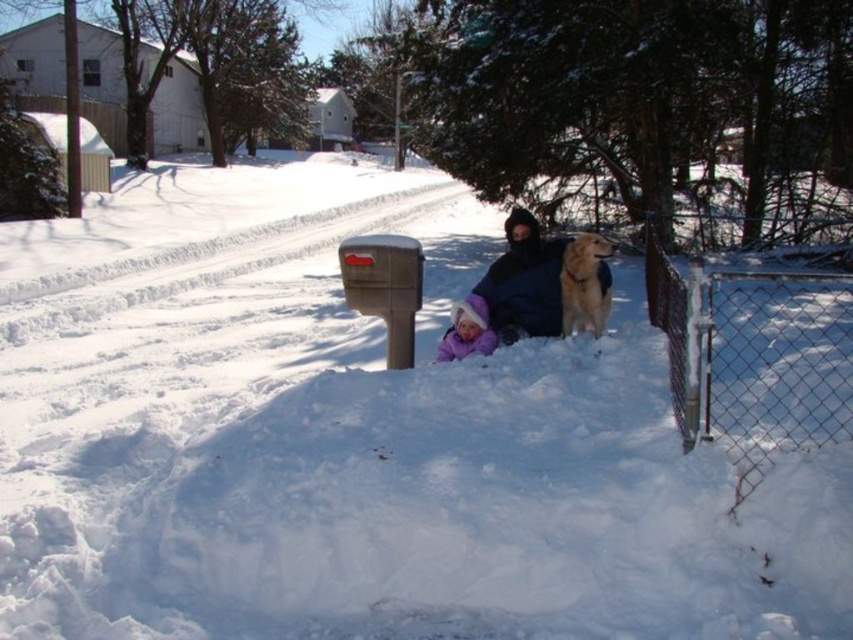
Question: Can you confirm if dark blue jacket at center is thinner than golden fur dog at center?

Choices:
 (A) no
 (B) yes

Answer: (A)

Question: Is gray plastic mailbox at center positioned behind golden fur dog at center?

Choices:
 (A) yes
 (B) no

Answer: (B)

Question: Which of the following is the farthest from the observer?

Choices:
 (A) (474, 301)
 (B) (392, 280)
 (C) (578, 296)

Answer: (A)

Question: Is chain-link fence at lower right thinner than golden fur dog at center?

Choices:
 (A) no
 (B) yes

Answer: (A)

Question: Estimate the real-world distances between objects in this image. Which object is farther from the golden fur dog at center?

Choices:
 (A) dark blue jacket at center
 (B) purple fleece hat at lower center
 (C) chain-link fence at lower right
 (D) gray plastic mailbox at center

Answer: (C)

Question: Based on their relative distances, which object is nearer to the golden fur dog at center?

Choices:
 (A) chain-link fence at lower right
 (B) gray plastic mailbox at center

Answer: (B)